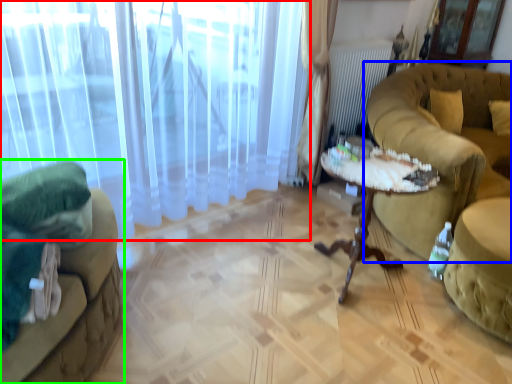
Question: Considering the real-world distances, which object is closest to curtain (highlighted by a red box)? studio couch (highlighted by a blue box) or studio couch (highlighted by a green box).

Choices:
 (A) studio couch
 (B) studio couch

Answer: (B)